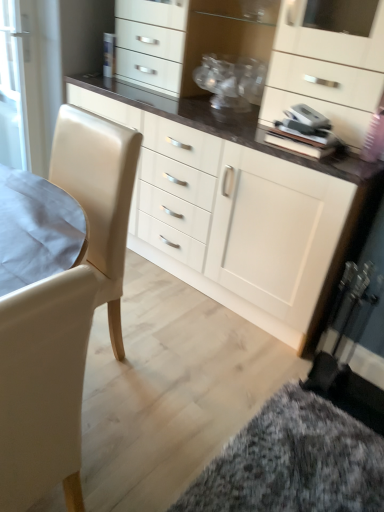
Where is `fluffy carpet at lower right`? This screenshot has height=512, width=384. fluffy carpet at lower right is located at coordinates (294, 462).

What is the approximate width of fluffy carpet at lower right?

fluffy carpet at lower right is 81.93 centimeters wide.

In order to face beige leather chair at left, should I rotate leftwards or rightwards?

To face it directly, rotate left by 24.153 degrees.

This screenshot has width=384, height=512. Find the location of `matte white cabinet at center`. matte white cabinet at center is located at coordinates (240, 209).

Identify the location of fluffy carpet at lower right. The height and width of the screenshot is (512, 384). (x=294, y=462).

Measure the distance from beige leather chair at left to fluffy carpet at lower right.

beige leather chair at left is 30.03 inches from fluffy carpet at lower right.

Is beige leather chair at left to the left of fluffy carpet at lower right from the viewer's perspective?

Yes, beige leather chair at left is to the left of fluffy carpet at lower right.

Considering the sizes of objects beige leather chair at left and fluffy carpet at lower right in the image provided, who is thinner, beige leather chair at left or fluffy carpet at lower right?

beige leather chair at left is thinner.

Is beige leather chair at left outside of fluffy carpet at lower right?

Yes, beige leather chair at left is not within fluffy carpet at lower right.

Is beige leather chair at left not inside leather-like white swivel chair at left?

That's correct, beige leather chair at left is outside of leather-like white swivel chair at left.

How much distance is there between beige leather chair at left and leather-like white swivel chair at left?

They are 70.10 centimeters apart.

Can you confirm if beige leather chair at left is wider than leather-like white swivel chair at left?

No.

Is beige leather chair at left next to leather-like white swivel chair at left and touching it?

No, beige leather chair at left is not touching leather-like white swivel chair at left.

In the scene shown: Which object is more forward, matte white cabinet at center or beige leather chair at left?

beige leather chair at left is in front.

Is matte white cabinet at center facing towards beige leather chair at left?

Yes, matte white cabinet at center is turned towards beige leather chair at left.

In terms of height, does matte white cabinet at center look taller or shorter compared to beige leather chair at left?

In the image, matte white cabinet at center appears to be taller than beige leather chair at left.

I want to click on cabinetry positioned vertically above the beige leather chair at left (from a real-world perspective), so click(x=240, y=209).

Considering the sizes of leather-like white swivel chair at left and matte white cabinet at center in the image, is leather-like white swivel chair at left wider or thinner than matte white cabinet at center?

Clearly, leather-like white swivel chair at left has less width compared to matte white cabinet at center.

Considering the positions of points (105, 144) and (204, 154), is point (105, 144) farther from camera compared to point (204, 154)?

No, it is not.

Does leather-like white swivel chair at left appear on the right side of matte white cabinet at center?

In fact, leather-like white swivel chair at left is to the left of matte white cabinet at center.

Is leather-like white swivel chair at left smaller than fluffy carpet at lower right?

Incorrect, leather-like white swivel chair at left is not smaller in size than fluffy carpet at lower right.

Looking at this image, is leather-like white swivel chair at left turned away from fluffy carpet at lower right?

No, fluffy carpet at lower right is not at the back of leather-like white swivel chair at left.

From the image's perspective, is leather-like white swivel chair at left on fluffy carpet at lower right?

Indeed, from the image's perspective, leather-like white swivel chair at left is shown above fluffy carpet at lower right.

Is leather-like white swivel chair at left touching fluffy carpet at lower right?

No, leather-like white swivel chair at left is not touching fluffy carpet at lower right.

Which is farther from the camera, (331, 479) or (117, 294)?

The point (117, 294) is farther.

Between fluffy carpet at lower right and leather-like white swivel chair at left, which one has smaller width?

leather-like white swivel chair at left is thinner.

At what (x,y) coordinates should I click in order to perform the action: click on swivel chair on the left side of fluffy carpet at lower right. Please return your answer as a coordinate pair (x, y). Looking at the image, I should click on (99, 196).

Is fluffy carpet at lower right spatially inside leather-like white swivel chair at left, or outside of it?

fluffy carpet at lower right lies outside leather-like white swivel chair at left.

In the scene shown: Can you confirm if fluffy carpet at lower right is wider than beige leather chair at left?

Indeed, fluffy carpet at lower right has a greater width compared to beige leather chair at left.

Is fluffy carpet at lower right positioned far away from beige leather chair at left?

No, fluffy carpet at lower right is not far from beige leather chair at left.

Which point is more forward, (x=354, y=436) or (x=24, y=496)?

Positioned in front is point (x=24, y=496).

In the image, is fluffy carpet at lower right on the left side or the right side of beige leather chair at left?

Based on their positions, fluffy carpet at lower right is located to the right of beige leather chair at left.

Identify the location of wide to the right of beige leather chair at left. (294, 462).

The width and height of the screenshot is (384, 512). What are the coordinates of `chair that appears below the leather-like white swivel chair at left (from the image's perspective)` in the screenshot? It's located at (43, 387).

Looking at the image, which one is located further to leather-like white swivel chair at left, fluffy carpet at lower right or beige leather chair at left?

The object further to leather-like white swivel chair at left is fluffy carpet at lower right.

Looking at the image, which one is located closer to matte white cabinet at center, leather-like white swivel chair at left or fluffy carpet at lower right?

leather-like white swivel chair at left.

When comparing their distances from leather-like white swivel chair at left, does matte white cabinet at center or fluffy carpet at lower right seem closer?

matte white cabinet at center.

From the picture: Looking at the image, which one is located closer to beige leather chair at left, fluffy carpet at lower right or leather-like white swivel chair at left?

Based on the image, leather-like white swivel chair at left appears to be nearer to beige leather chair at left.

Estimate the real-world distances between objects in this image. Which object is closer to leather-like white swivel chair at left, beige leather chair at left or fluffy carpet at lower right?

beige leather chair at left lies closer to leather-like white swivel chair at left than the other object.

Estimate the real-world distances between objects in this image. Which object is closer to beige leather chair at left, matte white cabinet at center or leather-like white swivel chair at left?

Based on the image, leather-like white swivel chair at left appears to be nearer to beige leather chair at left.

Considering their positions, is matte white cabinet at center positioned further to leather-like white swivel chair at left than beige leather chair at left?

beige leather chair at left.

In the scene shown: Looking at the image, which one is located further to leather-like white swivel chair at left, beige leather chair at left or matte white cabinet at center?

beige leather chair at left.

What are the coordinates of `swivel chair between matte white cabinet at center and fluffy carpet at lower right in the up-down direction` in the screenshot? It's located at [x=99, y=196].

I want to click on swivel chair between matte white cabinet at center and beige leather chair at left from top to bottom, so click(99, 196).

Locate an element on the screen. The image size is (384, 512). chair between leather-like white swivel chair at left and fluffy carpet at lower right is located at coordinates (43, 387).

Locate an element on the screen. The width and height of the screenshot is (384, 512). chair between matte white cabinet at center and fluffy carpet at lower right vertically is located at coordinates (43, 387).